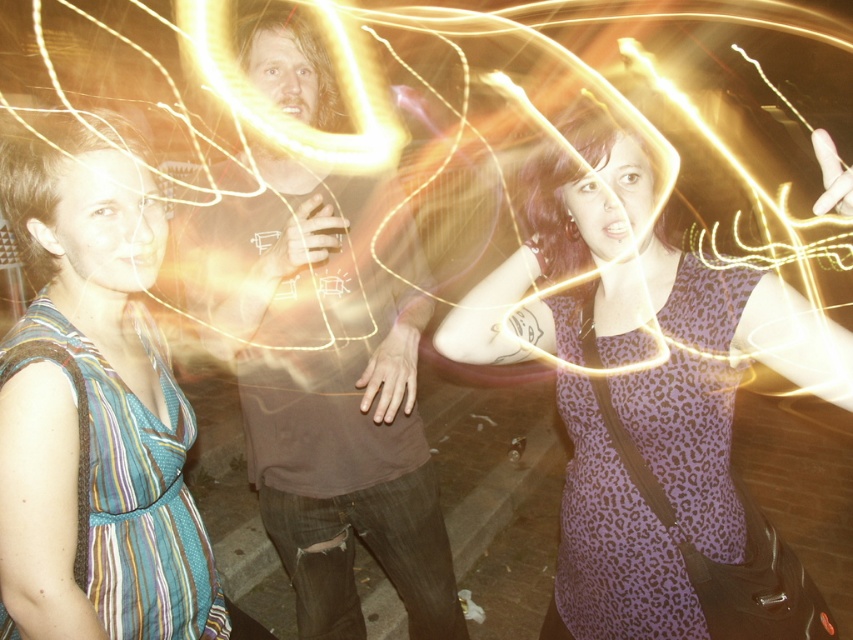
You are a photographer setting up a tripod to capture the scene between the brown cotton shirt at center and the striped fabric dress at left. The tripod requires a minimum of 18 inches between the two subjects to focus properly. Will the current distance suffice?

The distance between the brown cotton shirt at center and the striped fabric dress at left is 18.84 inches, which exceeds the required 18 inches. Therefore, the tripod can focus properly.

You are planning to hang both the purple leopard print dress at center and the striped fabric dress at left on a single hanger. The hanger can only hold items within 30 inches combined. Can both dresses fit together on the hanger?

The purple leopard print dress at center and striped fabric dress at left are 29.15 inches apart, so yes, they can fit together on the hanger since the combined length is under 30 inches.